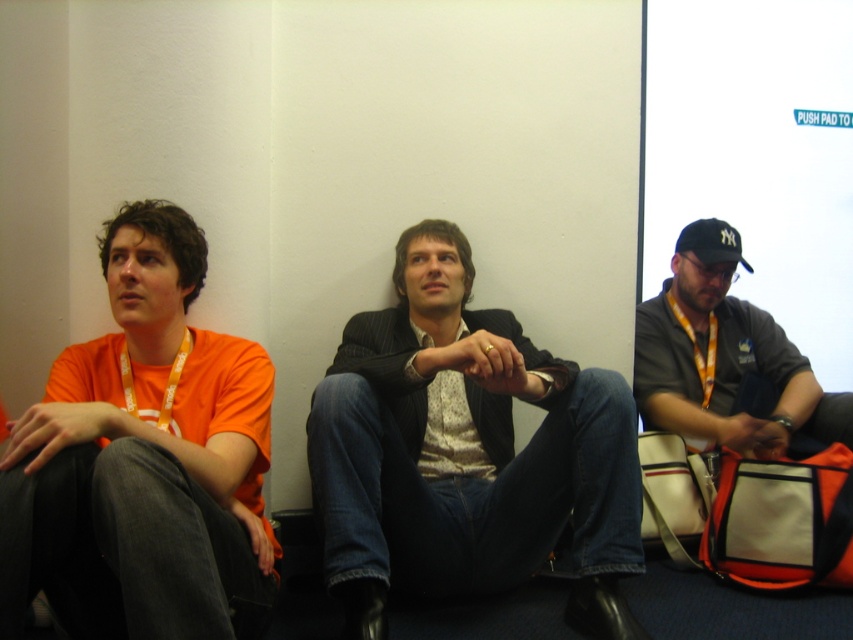
Question: Which point is closer to the camera?

Choices:
 (A) orange t-shirt at left
 (B) gray fabric shirt at center
 (C) black fabric baseball cap at right

Answer: (A)

Question: Based on their relative distances, which object is farther from the gray fabric shirt at center?

Choices:
 (A) orange t-shirt at left
 (B) black fabric baseball cap at right
 (C) matte black suit at center

Answer: (A)

Question: In this image, where is matte black suit at center located relative to black fabric baseball cap at right?

Choices:
 (A) left
 (B) right

Answer: (A)

Question: Is matte black suit at center smaller than orange t-shirt at left?

Choices:
 (A) yes
 (B) no

Answer: (B)

Question: Does matte black suit at center appear over orange t-shirt at left?

Choices:
 (A) no
 (B) yes

Answer: (A)

Question: Which point is farther from the camera taking this photo?

Choices:
 (A) (125, 257)
 (B) (462, 424)
 (C) (695, 250)

Answer: (C)